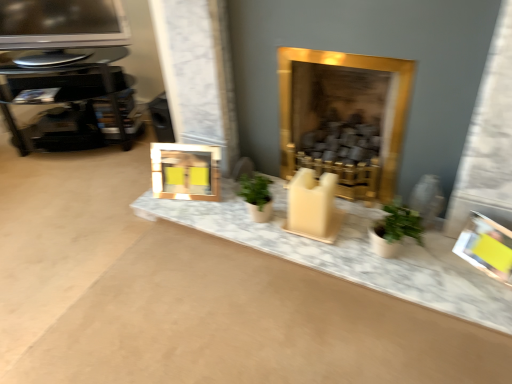
Question: Considering the relative positions of metallic glossy television at upper left and gold metallic picture frame at center, positioned as the second picture frame in front-to-back order, in the image provided, is metallic glossy television at upper left to the left or to the right of gold metallic picture frame at center, positioned as the second picture frame in front-to-back order,?

Choices:
 (A) left
 (B) right

Answer: (A)

Question: Choose the correct answer: Is metallic glossy television at upper left inside gold metallic picture frame at center, acting as the second picture frame starting from the bottom, or outside it?

Choices:
 (A) inside
 (B) outside

Answer: (B)

Question: Estimate the real-world distances between objects in this image. Which object is farther from the gold metallic picture frame at center, which is counted as the 1th picture frame, starting from the left?

Choices:
 (A) marble counter top at center
 (B) yellow paper picture frame at right, arranged as the 2th picture frame when viewed from the top
 (C) gold metallic fireplace at center
 (D) metallic glossy television at upper left
 (E) black glass table at left

Answer: (B)

Question: Which object is positioned closest to the gold metallic picture frame at center, marked as the first picture frame in a back-to-front arrangement?

Choices:
 (A) gold metallic fireplace at center
 (B) black glass table at left
 (C) marble counter top at center
 (D) yellow paper picture frame at right, which is counted as the first picture frame, starting from the front
 (E) metallic glossy television at upper left

Answer: (C)